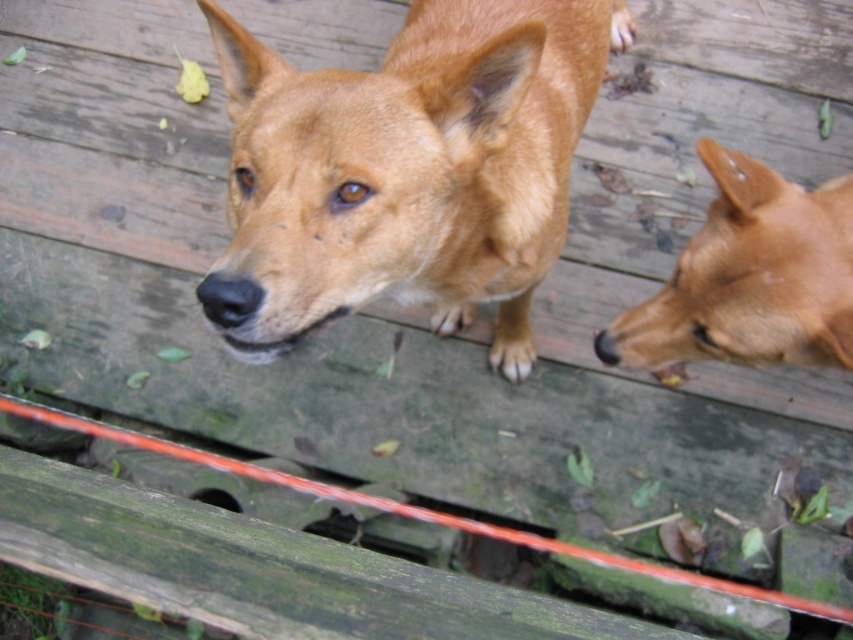
You are a photographer trying to capture the perfect shot of the brown furry dog at upper center. Based on its 2D coordinates in the image, which part of the frame should you focus on to ensure the dog is centered in your photo?

The brown furry dog at upper center is located at coordinates 0.267 on the x axis and 0.477 on the y axis, so to center it in the frame, focus on the upper center area corresponding to these coordinates.

You are standing on the wooden deck and see both the brown furry dog at upper center and the brown furry dog at right. Which dog is closer to the left edge of the deck?

The brown furry dog at upper center is closer to the left edge of the deck because it is positioned on the left side of the brown furry dog at right.